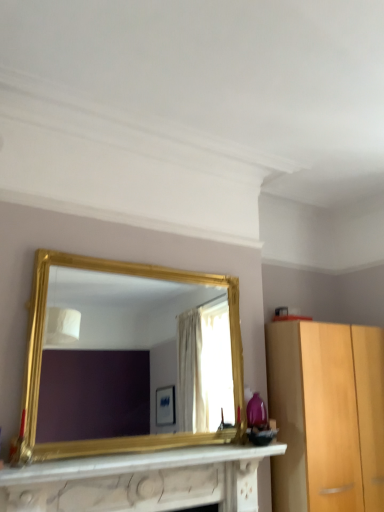
Question: Relative to gold/gilded mirror at center, is white marble fireplace at lower center in front or behind?

Choices:
 (A) behind
 (B) front

Answer: (B)

Question: Based on their positions, is white marble fireplace at lower center located to the left or right of gold/gilded mirror at center?

Choices:
 (A) right
 (B) left

Answer: (B)

Question: Which is correct: white marble fireplace at lower center is inside gold/gilded mirror at center, or outside of it?

Choices:
 (A) outside
 (B) inside

Answer: (A)

Question: From their relative heights in the image, would you say gold/gilded mirror at center is taller or shorter than white marble fireplace at lower center?

Choices:
 (A) tall
 (B) short

Answer: (A)

Question: Is point (44, 320) closer or farther from the camera than point (248, 504)?

Choices:
 (A) farther
 (B) closer

Answer: (A)

Question: Would you say gold/gilded mirror at center is to the left or to the right of white marble fireplace at lower center in the picture?

Choices:
 (A) right
 (B) left

Answer: (A)

Question: Considering the positions of gold/gilded mirror at center and white marble fireplace at lower center in the image, is gold/gilded mirror at center bigger or smaller than white marble fireplace at lower center?

Choices:
 (A) small
 (B) big

Answer: (B)